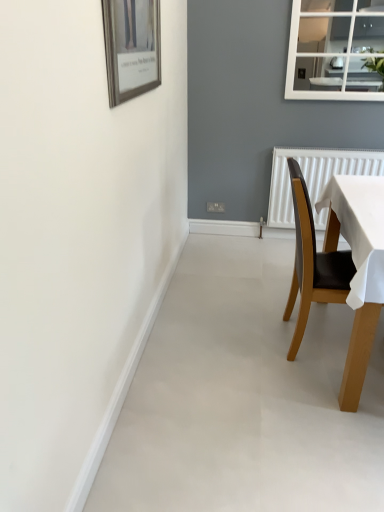
Find the location of a particular element. vacant space positioned to the left of brown wooden chair at right is located at coordinates (243, 342).